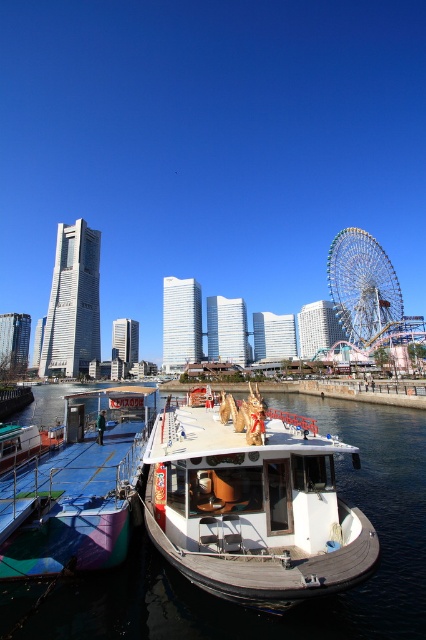
Question: Can you confirm if white matte boat at center is positioned above metallic silver ferris wheel at right?

Choices:
 (A) yes
 (B) no

Answer: (B)

Question: Does white matte boat at center have a greater width compared to multicolored painted boat at lower left?

Choices:
 (A) no
 (B) yes

Answer: (A)

Question: Which object appears farthest from the camera in this image?

Choices:
 (A) metallic silver ferris wheel at right
 (B) white matte boat at center

Answer: (A)

Question: Which point is farther to the camera?

Choices:
 (A) (14, 538)
 (B) (368, 333)
 (C) (282, 529)

Answer: (B)

Question: Which object is the farthest from the white matte boat at center?

Choices:
 (A) metallic silver ferris wheel at right
 (B) multicolored painted boat at lower left

Answer: (A)

Question: Does white matte boat at center appear over multicolored painted boat at lower left?

Choices:
 (A) no
 (B) yes

Answer: (B)